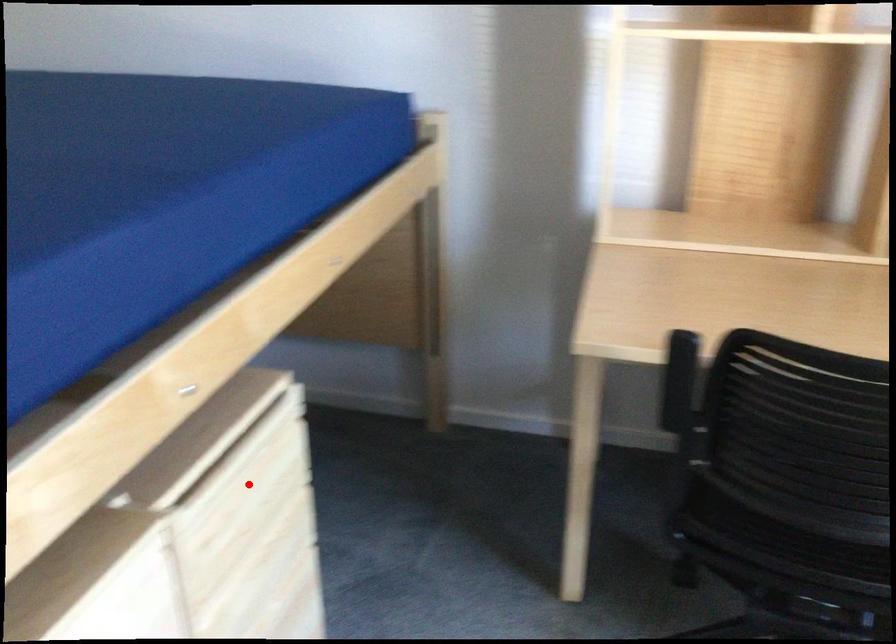
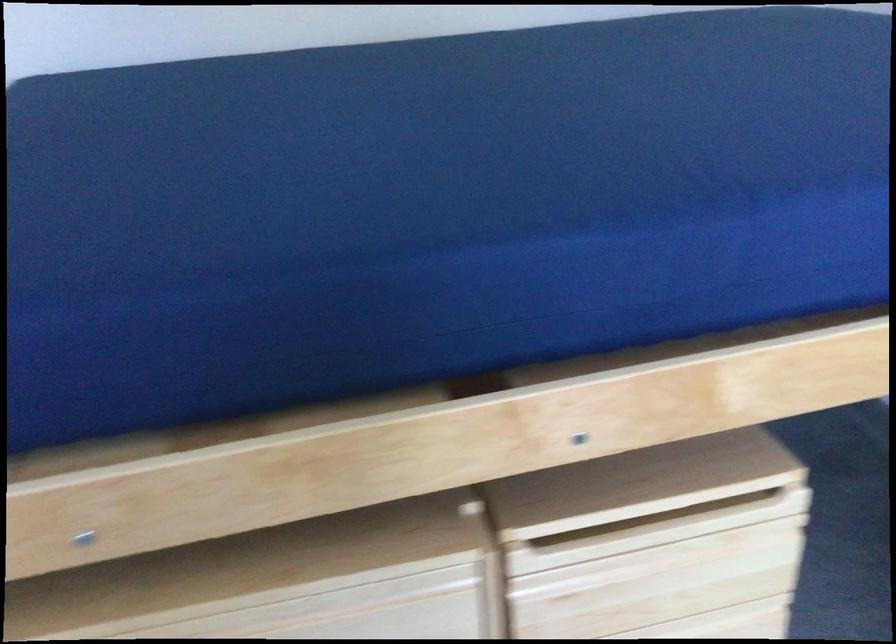
Question: I am providing you with two images of the same scene from different viewpoints. In image1, a red point is highlighted. Considering the same 3D point in image2, which of the following is correct?

Choices:
 (A) It is closer
 (B) It is farther

Answer: (A)